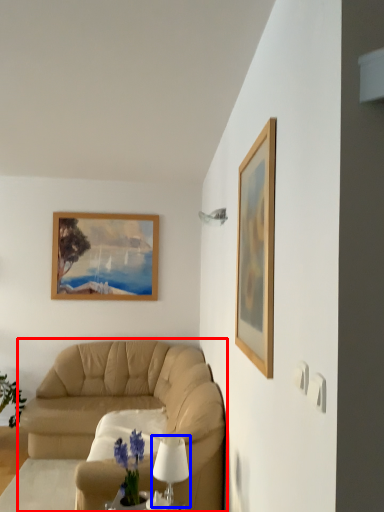
Question: Among these objects, which one is nearest to the camera, studio couch (highlighted by a red box) or table lamp (highlighted by a blue box)?

Choices:
 (A) studio couch
 (B) table lamp

Answer: (B)